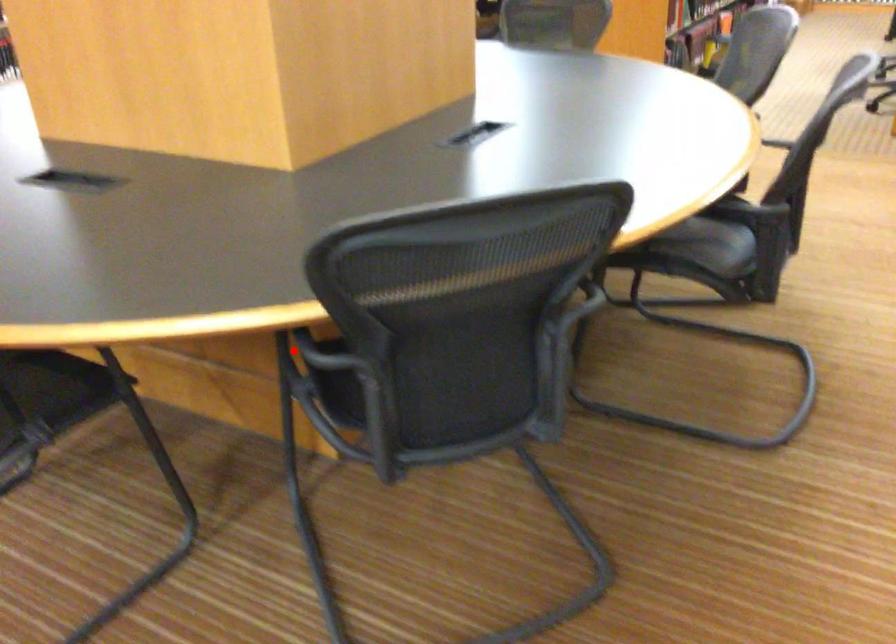
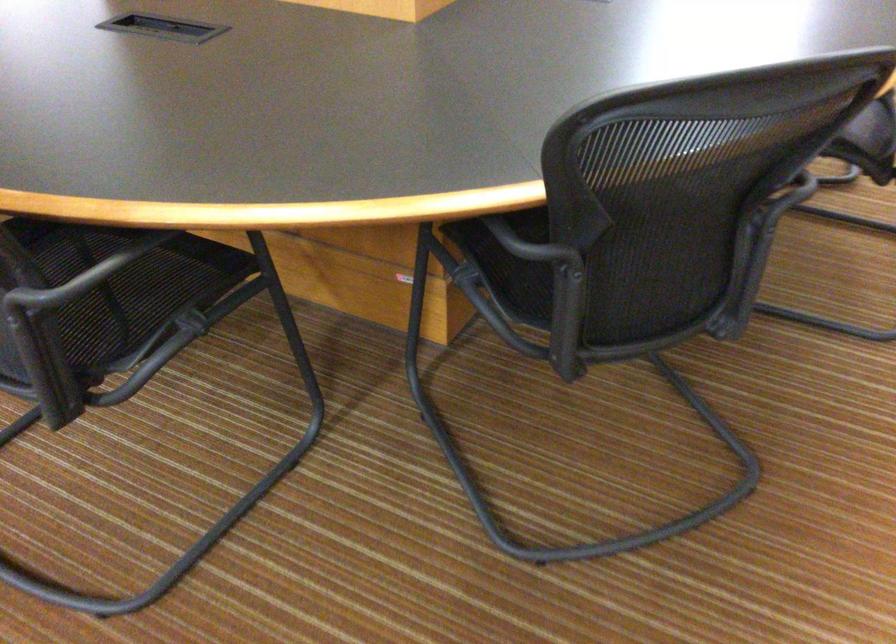
Question: I am providing you with two images of the same scene from different viewpoints. Image1 has a red point marked. In image2, the corresponding 3D location appears at what relative position? Reply with the corresponding letter.

Choices:
 (A) Closer
 (B) Farther

Answer: (A)